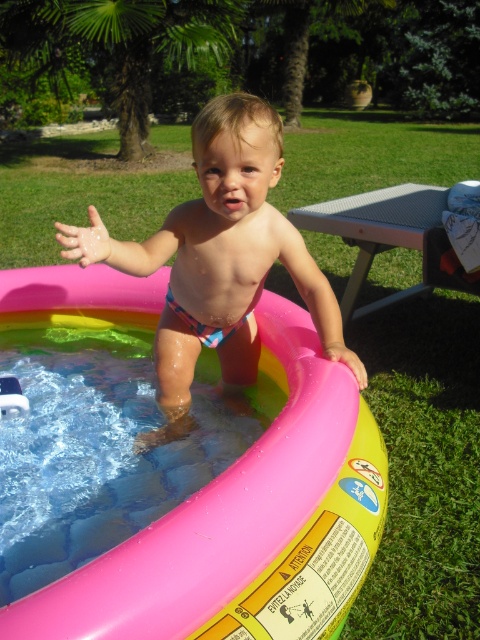
Who is taller, multicolored fabric shorts at center or gray metal picnic table at right?

gray metal picnic table at right is taller.

Is point (250, 221) positioned in front of point (430, 214)?

Yes, point (250, 221) is closer to viewer.

Is point (192, 252) positioned before point (403, 202)?

Yes, point (192, 252) is closer to viewer.

Where is `multicolored fabric shorts at center`? multicolored fabric shorts at center is located at coordinates (220, 257).

Which is below, matte pink inflatable pool at center or multicolored fabric shorts at center?

matte pink inflatable pool at center is lower down.

Can you confirm if matte pink inflatable pool at center is positioned to the right of multicolored fabric shorts at center?

No, matte pink inflatable pool at center is not to the right of multicolored fabric shorts at center.

This screenshot has height=640, width=480. What do you see at coordinates (218, 259) in the screenshot? I see `matte pink inflatable pool at center` at bounding box center [218, 259].

I want to click on matte pink inflatable pool at center, so click(218, 259).

Is the position of pink rubber tub at center more distant than that of gray metal picnic table at right?

No, it is in front of gray metal picnic table at right.

Is point (25, 268) farther from camera compared to point (421, 202)?

No, (25, 268) is in front of (421, 202).

The height and width of the screenshot is (640, 480). Find the location of `pink rubber tub at center`. pink rubber tub at center is located at coordinates (245, 522).